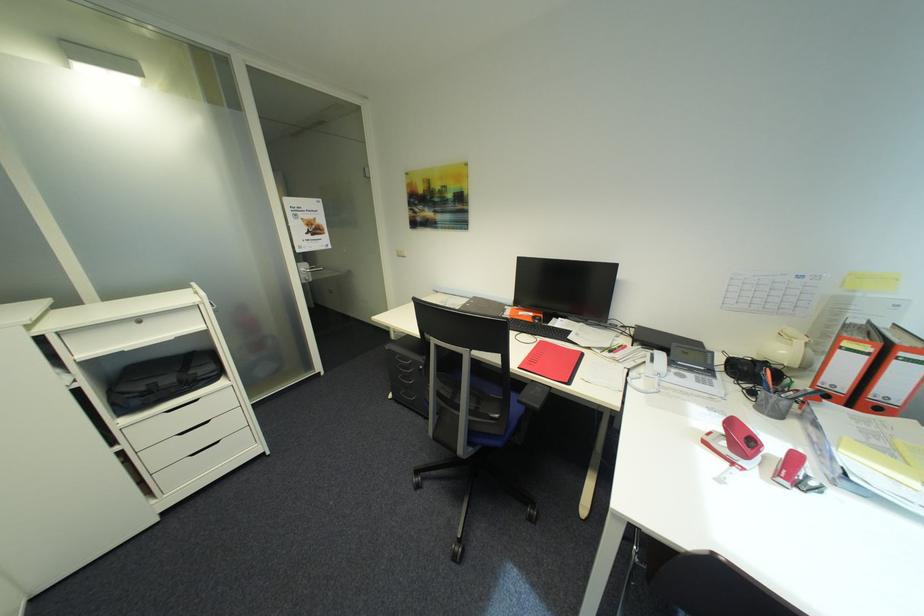
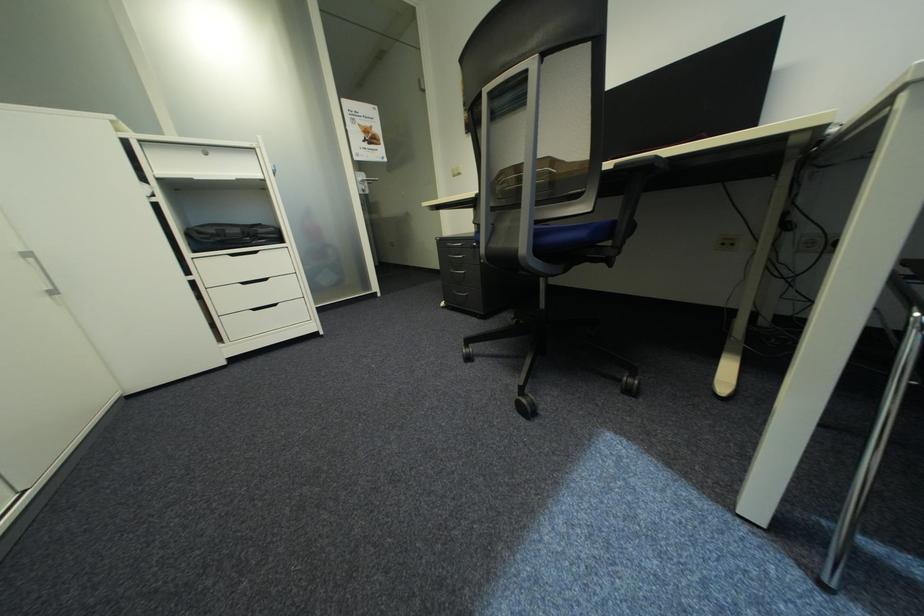
Find the pixel in the second image that matches [344,506] in the first image.

(384, 369)